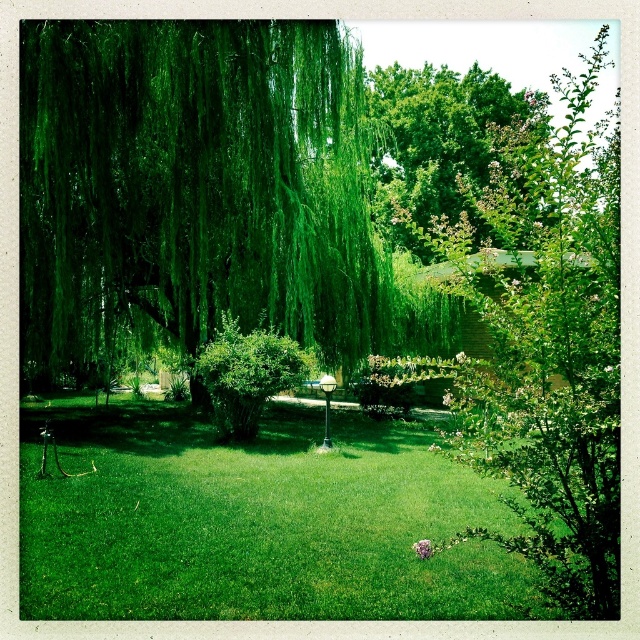
What do you see at coordinates (545, 342) in the screenshot? I see `green leafy tree at center` at bounding box center [545, 342].

Is green leafy tree at center wider than green leafy bush at center?

Correct, the width of green leafy tree at center exceeds that of green leafy bush at center.

Looking at this image, measure the distance between point (412, 376) and camera.

Point (412, 376) and camera are 4.61 meters apart.

I want to click on green leafy tree at center, so click(545, 342).

What do you see at coordinates (253, 518) in the screenshot? I see `green grass at center` at bounding box center [253, 518].

Is point (20, 541) closer to camera compared to point (538, 260)?

No, it is behind (538, 260).

Find the location of `green grass at center`. green grass at center is located at coordinates (253, 518).

Does green leafy willow at upper left have a smaller size compared to green grass at center?

Actually, green leafy willow at upper left might be larger than green grass at center.

Is green leafy willow at upper left further to camera compared to green grass at center?

Yes, it is behind green grass at center.

This screenshot has height=640, width=640. In order to click on green leafy willow at upper left in this screenshot , I will do `click(193, 188)`.